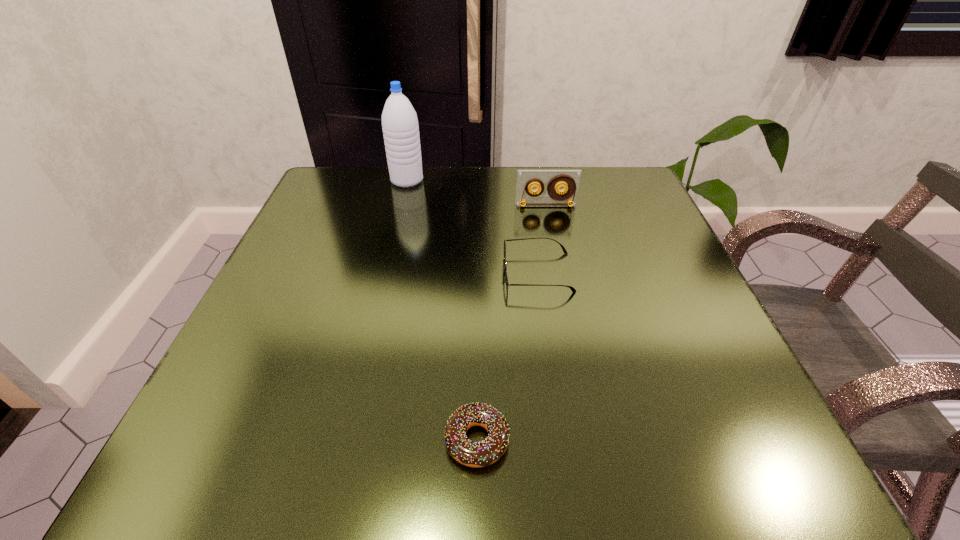
In the image, there is a desktop. Where is `vacant space at the far left corner`? This screenshot has width=960, height=540. vacant space at the far left corner is located at coordinates (370, 169).

Locate an element on the screen. free location at the near left corner is located at coordinates (195, 427).

Where is `free spot at the far right corner of the desktop`? The height and width of the screenshot is (540, 960). free spot at the far right corner of the desktop is located at coordinates (635, 210).

Find the location of a particular element. The image size is (960, 540). free space at the near right corner of the desktop is located at coordinates (666, 429).

Identify the location of vacant point located between the third object from right to left and the second tallest object. The width and height of the screenshot is (960, 540). (512, 322).

Where is `vacant area between the water bottle and the second tallest object`? This screenshot has height=540, width=960. vacant area between the water bottle and the second tallest object is located at coordinates (476, 193).

Find the location of a particular element. vacant region between the nearest object and the tallest object is located at coordinates (x=442, y=310).

Image resolution: width=960 pixels, height=540 pixels. What are the coordinates of `free area in between the second object from left to right and the water bottle` in the screenshot? It's located at (442, 310).

The image size is (960, 540). I want to click on vacant point located between the nearest object and the second farthest object, so click(x=512, y=322).

Image resolution: width=960 pixels, height=540 pixels. I want to click on empty space between the third shortest object and the second object from left to right, so click(512, 322).